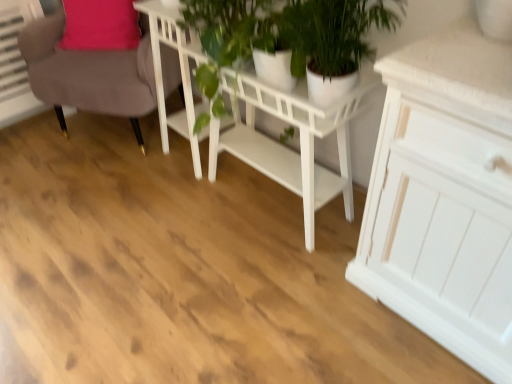
The image size is (512, 384). I want to click on vacant location below suede-like brown chair at upper left (from a real-world perspective), so click(x=106, y=134).